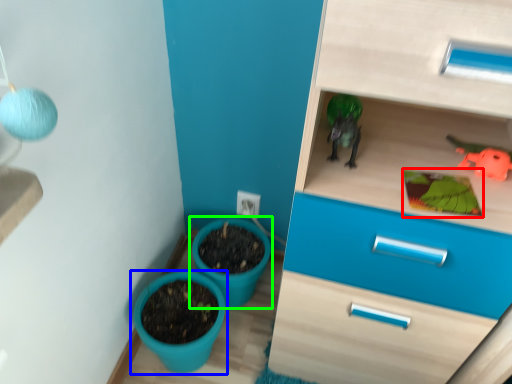
Question: Based on their relative distances, which object is nearer to plant (highlighted by a red box)? Choose from flowerpot (highlighted by a blue box) and flowerpot (highlighted by a green box).

Choices:
 (A) flowerpot
 (B) flowerpot

Answer: (B)